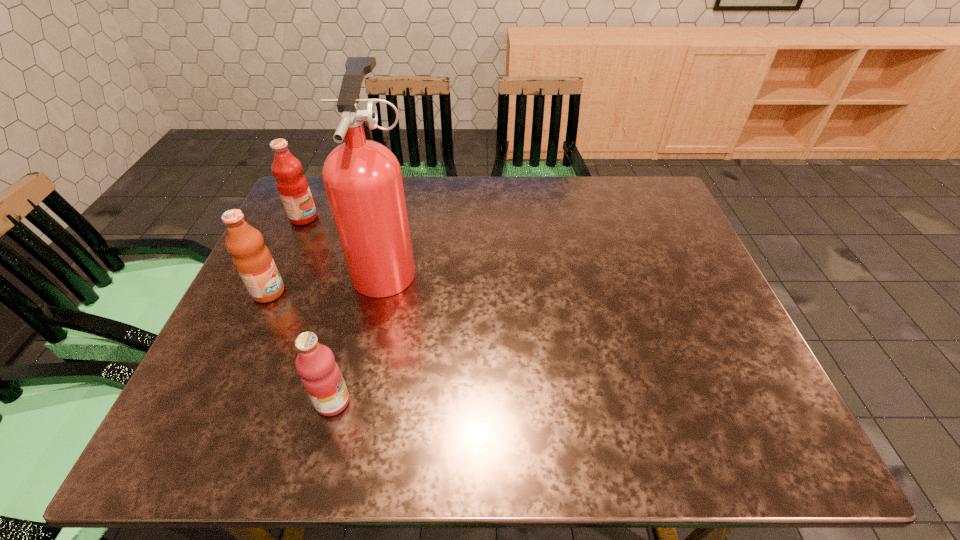
Where is `fire extinguisher`? fire extinguisher is located at coordinates (362, 178).

You are a GUI agent. You are given a task and a screenshot of the screen. Output one action in this format:
    pyautogui.click(x=<x>, y=<y>)
    Task: Click on the farthest object
    This screenshot has height=540, width=960.
    Given the screenshot: What is the action you would take?
    pyautogui.click(x=292, y=185)

This screenshot has height=540, width=960. I want to click on the second nearest fruit juice, so click(x=252, y=259).

Where is `the rightmost fruit juice`? the rightmost fruit juice is located at coordinates (320, 374).

Image resolution: width=960 pixels, height=540 pixels. Identify the location of the nearest object. (320, 374).

I want to click on free spot located 0.320m on the right of the fire extinguisher, so click(x=540, y=266).

What are the coordinates of `free space located on the front label of the farthest object` in the screenshot? It's located at (368, 218).

Where is `vacant space located on the front label of the second farthest fruit juice`? Image resolution: width=960 pixels, height=540 pixels. vacant space located on the front label of the second farthest fruit juice is located at coordinates (313, 292).

The width and height of the screenshot is (960, 540). In order to click on free space located 0.380m on the label of the rightmost fruit juice in this screenshot , I will do `click(540, 402)`.

Where is `object that is at the far edge`? This screenshot has width=960, height=540. object that is at the far edge is located at coordinates pyautogui.click(x=292, y=185).